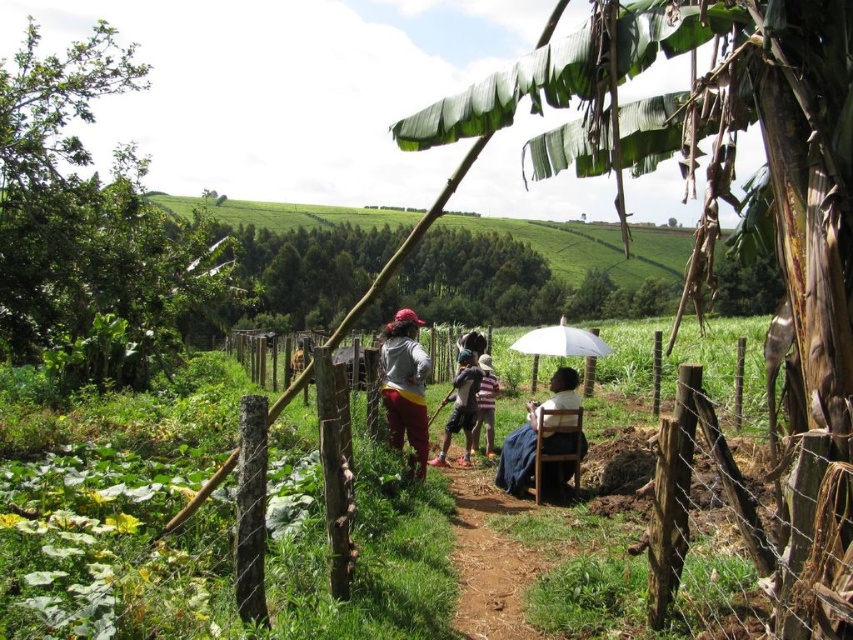
Does point (473, 388) lie in front of point (561, 326)?

No, (473, 388) is behind (561, 326).

Does point (431, 461) come in front of point (563, 326)?

No, it is not.

At what (x,y) coordinates should I click in order to perform the action: click on dark brown leather shorts at center. Please return your answer as a coordinate pair (x, y). Looking at the image, I should click on (460, 406).

Based on the photo, does matte gray hoodie at center appear under dark brown leather shorts at center?

No.

Does matte gray hoodie at center have a greater width compared to dark brown leather shorts at center?

No, matte gray hoodie at center is not wider than dark brown leather shorts at center.

Identify the location of matte gray hoodie at center. (405, 385).

Is brown wooden fence at center below striped cotton shirt at center?

No, brown wooden fence at center is not below striped cotton shirt at center.

Consider the image. Is brown wooden fence at center taller than striped cotton shirt at center?

Yes.

What do you see at coordinates (735, 534) in the screenshot?
I see `brown wooden fence at center` at bounding box center [735, 534].

Identify the location of brown wooden fence at center. The image size is (853, 640). (735, 534).